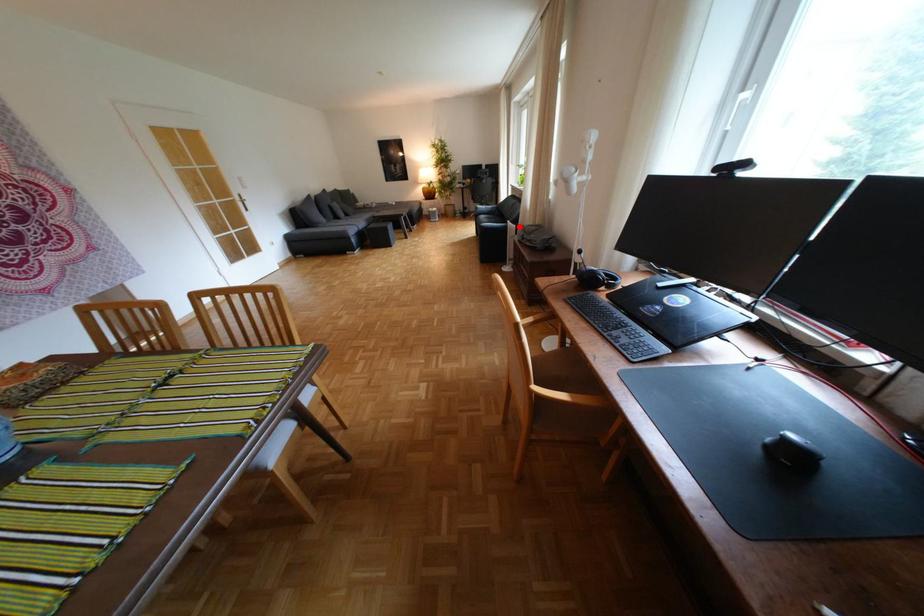
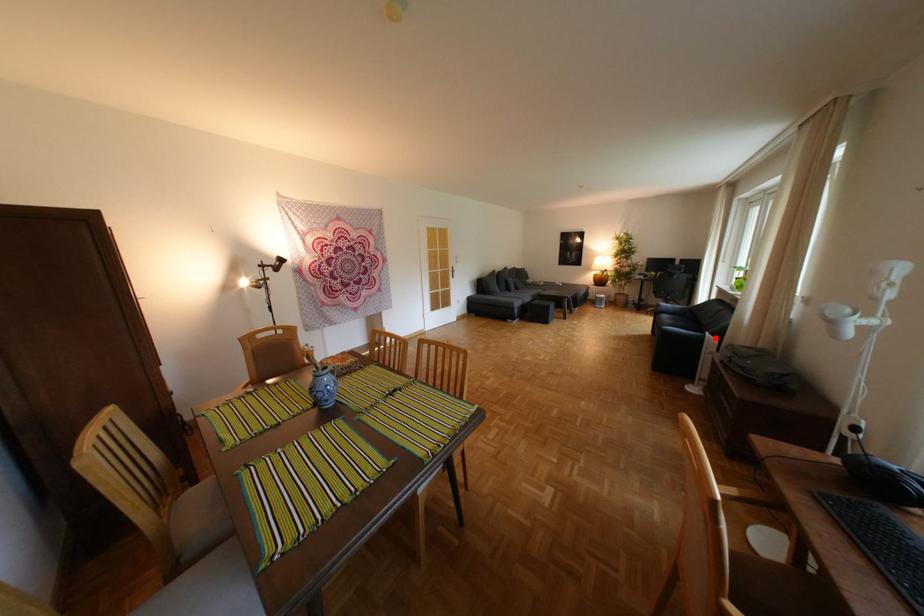
I am providing you with two images of the same scene from different viewpoints. A red point is marked on the first image and another point is marked on the second image. Do the highlighted points in image1 and image2 indicate the same real-world spot?

Yes